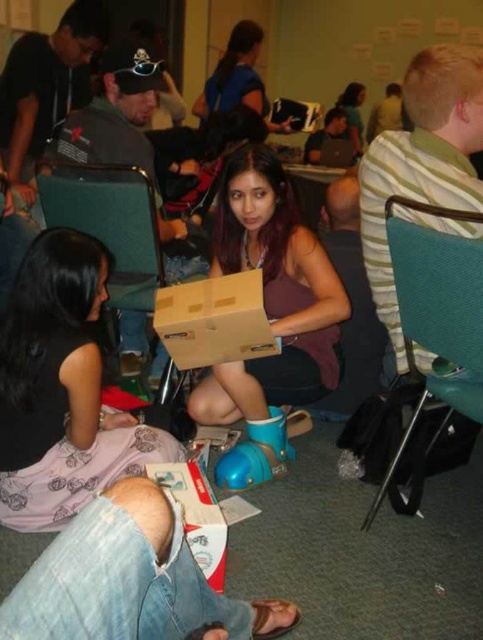
You are organizing a small event and need to seat a guest who requires a chair. You have a teal fabric chair at right and a matte brown hair at upper center available. Which item is suitable for seating?

The teal fabric chair at right is suitable for seating because it is a chair, while the matte brown hair at upper center is a person and cannot be used as seating.

You are standing in the room and want to find the matte pink dress at center. According to the coordinates given, where should you look to find it?

The matte pink dress at center is located at the 2D coordinates point (x=60, y=388).